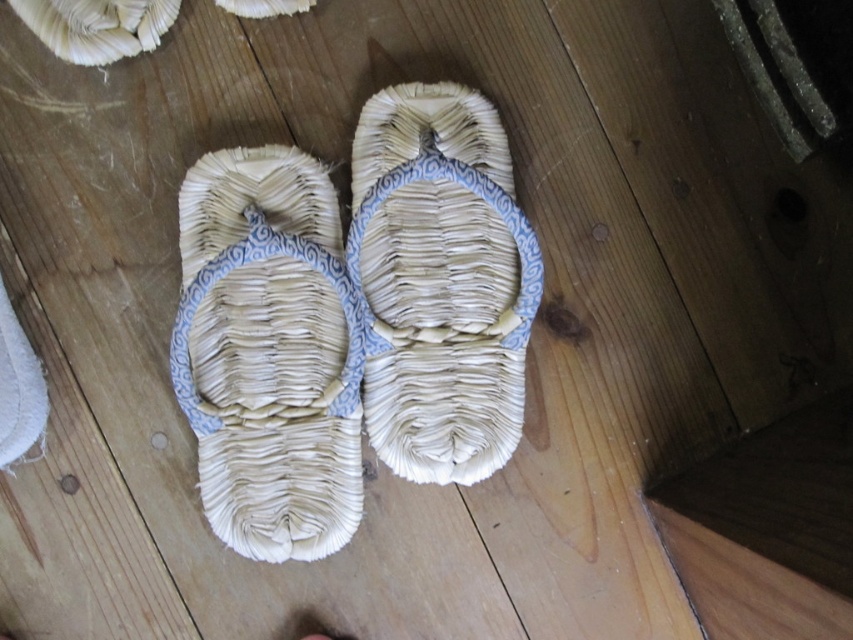
Between woven straw sandal at center and natural fiber sandal at center, which one is positioned lower?

woven straw sandal at center is below.

Is the position of woven straw sandal at center more distant than that of natural fiber sandal at center?

No, woven straw sandal at center is in front of natural fiber sandal at center.

Which is in front, point (322, 384) or point (422, 481)?

Point (322, 384)

Where is `woven straw sandal at center`? The height and width of the screenshot is (640, 853). woven straw sandal at center is located at coordinates (270, 353).